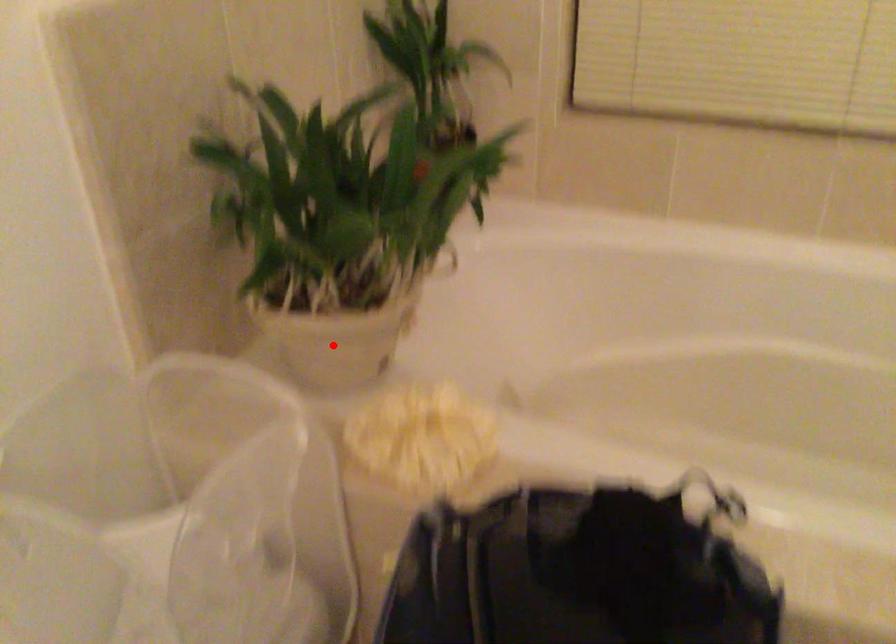
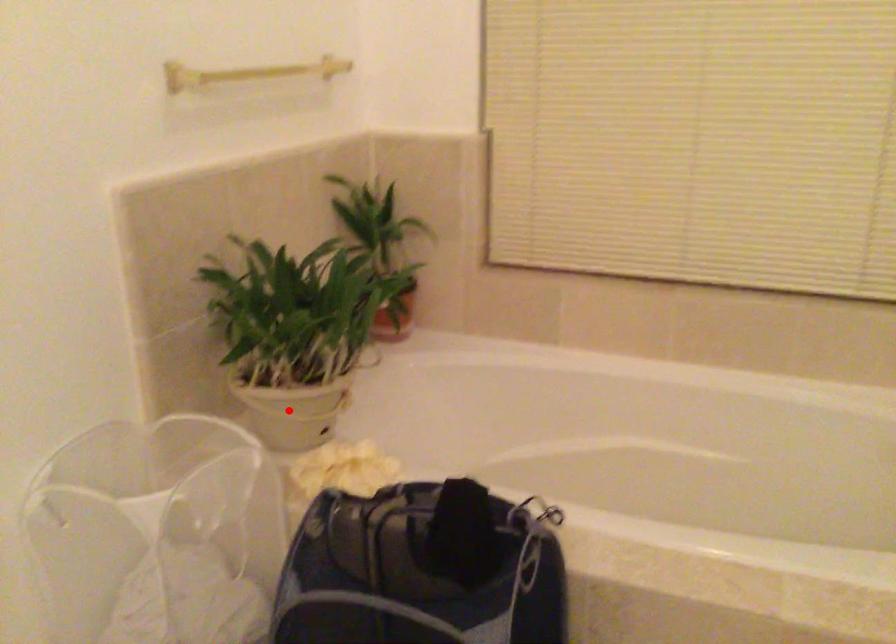
I am providing you with two images of the same scene from different viewpoints. A red point is marked on the first image and another point is marked on the second image. Is the marked point in image1 the same physical position as the marked point in image2?

Yes